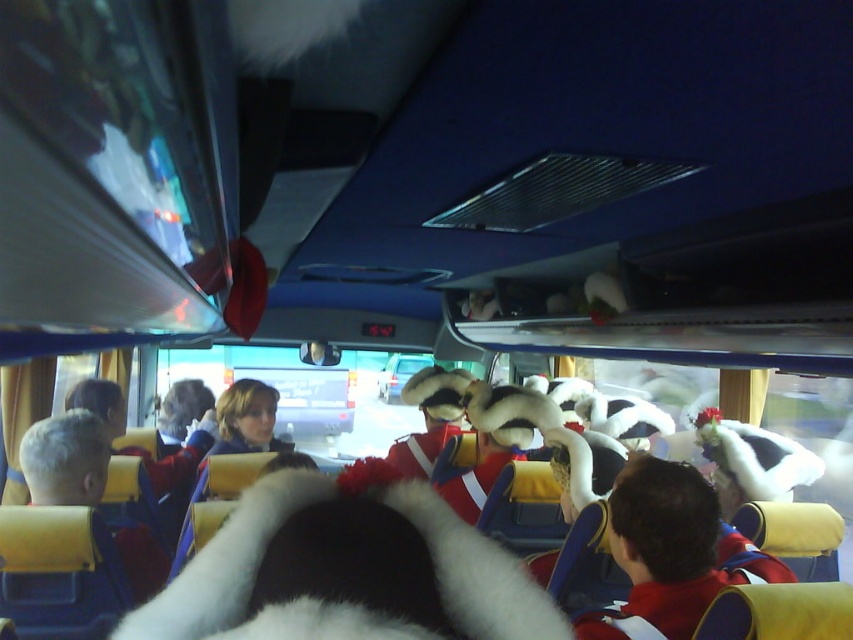
Is red fabric uniform at center positioned at the back of gray hair at left?

No, red fabric uniform at center is in front of gray hair at left.

This screenshot has width=853, height=640. In order to click on red fabric uniform at center in this screenshot , I will do `click(660, 548)`.

Where is `red fabric uniform at center`? red fabric uniform at center is located at coordinates 660,548.